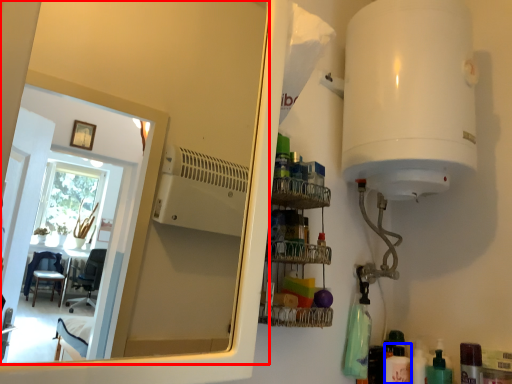
Question: Which point is closer to the camera, mirror (highlighted by a red box) or toiletry (highlighted by a blue box)?

Choices:
 (A) mirror
 (B) toiletry

Answer: (A)